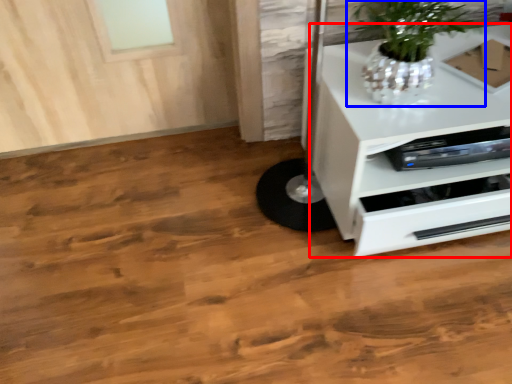
Question: Which point is further to the camera, chest of drawers (highlighted by a red box) or houseplant (highlighted by a blue box)?

Choices:
 (A) chest of drawers
 (B) houseplant

Answer: (A)